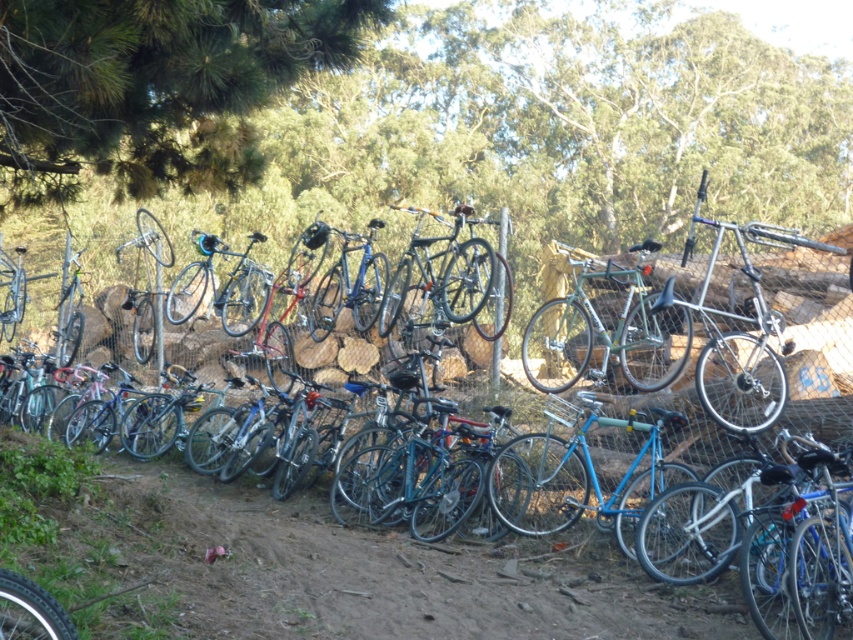
You are standing in front of the bicycles parked along the wire fence. There are two points marked on the image, one at coordinate point (325,566) and another at point (223,26). Which point is nearer to you?

Point (325,566) is closer to the camera than point (223,26), so the point at (325,566) is nearer to you.